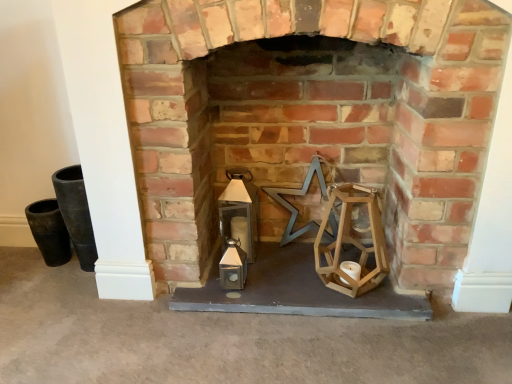
What is the approximate width of metallic lantern at center?

metallic lantern at center is 16.78 inches in width.

Locate an element on the screen. metallic lantern at center is located at coordinates (362, 135).

Describe the element at coordinates (362, 135) in the screenshot. I see `metallic lantern at center` at that location.

Where is `metallic lantern at center`? metallic lantern at center is located at coordinates coord(362,135).